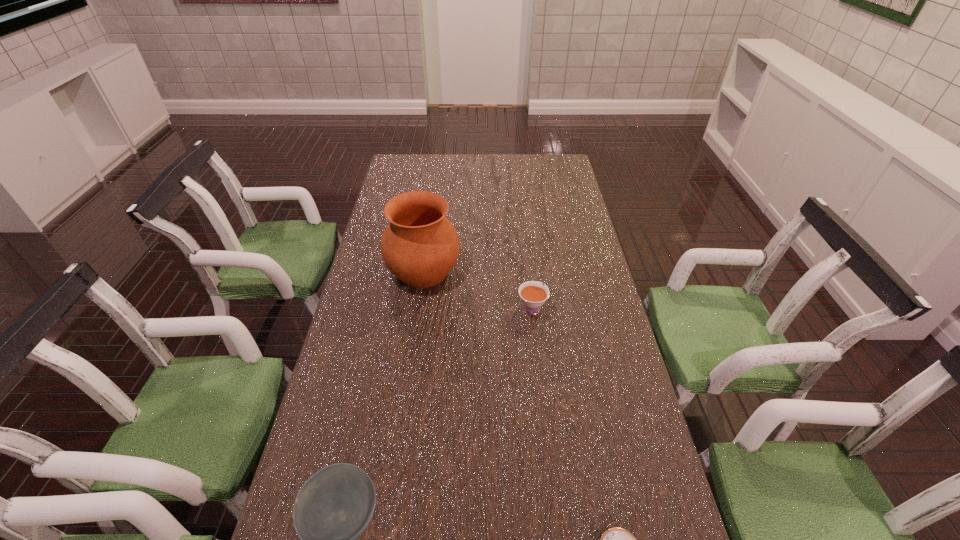
You are a GUI agent. You are given a task and a screenshot of the screen. Output one action in this format:
    pyautogui.click(x=<x>, y=<y>)
    Task: Click on the pottery
    The image size is (960, 540).
    Given the screenshot: What is the action you would take?
    pyautogui.click(x=420, y=246)

The image size is (960, 540). Find the location of `the farther teacup`. the farther teacup is located at coordinates (533, 294).

Identify the location of the taller teacup. (533, 294).

You are a GUI agent. You are given a task and a screenshot of the screen. Output one action in this format:
    pyautogui.click(x=<x>, y=<y>)
    Task: Click on the free space located 0.320m on the back of the tallest object
    
    Given the screenshot: What is the action you would take?
    pyautogui.click(x=434, y=198)

This screenshot has height=540, width=960. I want to click on vacant space located 0.190m on the side of the third object from left to right with the handle, so click(526, 257).

You are a GUI agent. You are given a task and a screenshot of the screen. Output one action in this format:
    pyautogui.click(x=<x>, y=<y>)
    Task: Click on the vacant space situated on the side of the third object from left to right with the handle
    The image size is (960, 540).
    Given the screenshot: What is the action you would take?
    pyautogui.click(x=525, y=254)

Locate an element on the screen. Image resolution: width=960 pixels, height=540 pixels. vacant space located on the side of the third object from left to right with the handle is located at coordinates (521, 222).

This screenshot has width=960, height=540. In order to click on object located at the left edge in this screenshot , I will do `click(420, 246)`.

The height and width of the screenshot is (540, 960). I want to click on blank space at the far edge of the desktop, so click(506, 173).

This screenshot has width=960, height=540. Identify the location of vacant region at the left edge of the desktop. (372, 406).